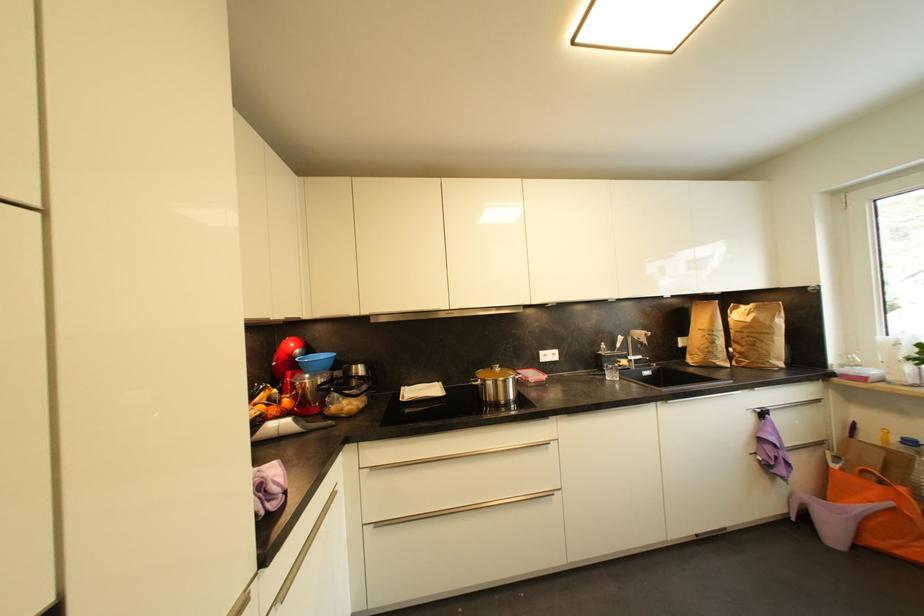
Find where to lift the blue bowl. Please return your answer as a coordinate pair (x, y).

(315, 362)